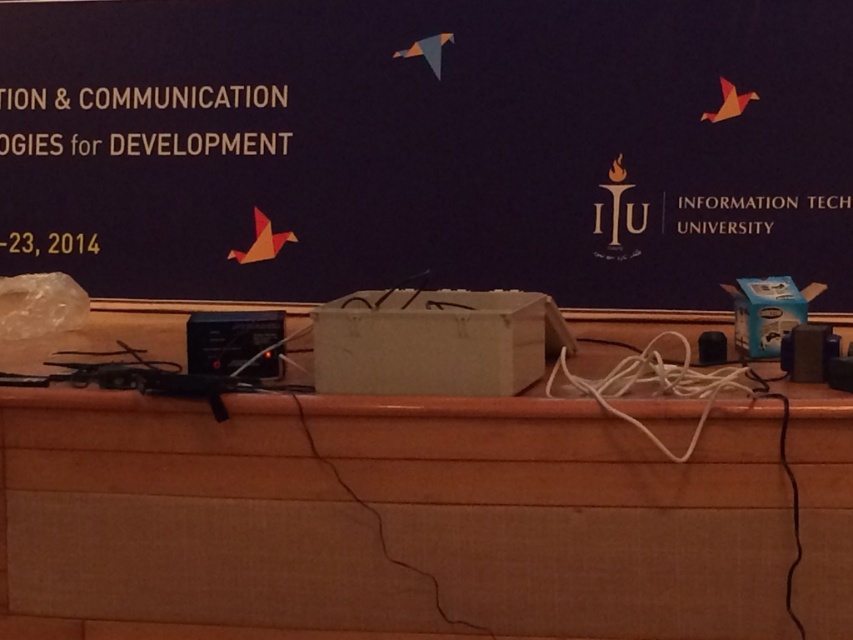
Between matte cardboard bulletin board at center and wooden table at center, which one is positioned lower?

wooden table at center is below.

Which is behind, point (329, 298) or point (827, 576)?

Positioned behind is point (329, 298).

Image resolution: width=853 pixels, height=640 pixels. Identify the location of matte cardboard bulletin board at center. (428, 145).